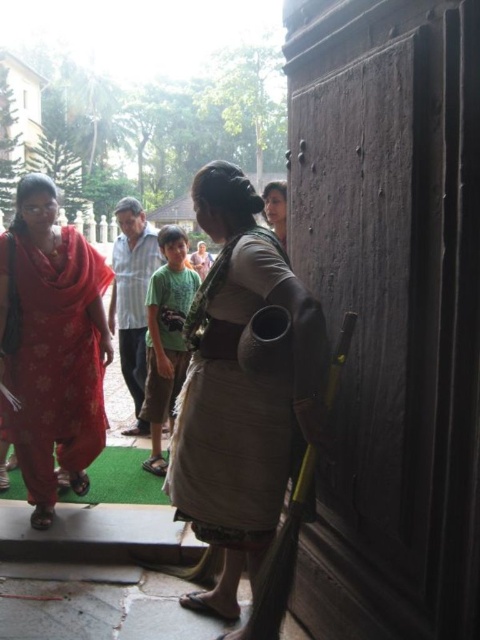
You are a visitor at the entrance of the building. You want to know which object is taller between the dark wood door at right and the floral fabric sari at left. Can you tell me?

The dark wood door at right is taller than the floral fabric sari at left according to the description.

A child is standing at point (394, 218) and wants to reach the door without stepping into the puddle. The puddle is located between the child and the door. What is the minimum distance the child must walk to safely reach the door?

The minimum distance the child must walk to safely reach the door is 1.94 meters.